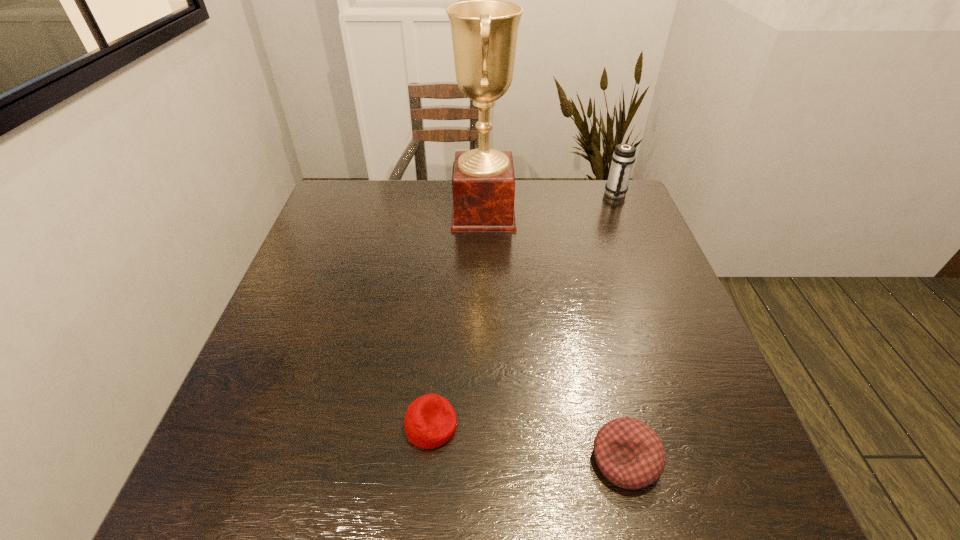
Where is `vacant region located on the side with the handle of the thermos bottle`? The height and width of the screenshot is (540, 960). vacant region located on the side with the handle of the thermos bottle is located at coordinates (655, 291).

Identify the location of vacant space located on the left of the third object from left to right. This screenshot has height=540, width=960. (478, 460).

The height and width of the screenshot is (540, 960). What are the coordinates of `blank space located on the seat area of the shorter beanbag` in the screenshot? It's located at [x=506, y=426].

The image size is (960, 540). Identify the location of trophy cup located in the far edge section of the desktop. point(484,29).

This screenshot has width=960, height=540. In order to click on thermos bottle located at the far edge in this screenshot , I will do `click(623, 157)`.

Where is `object situated at the near edge`? The width and height of the screenshot is (960, 540). object situated at the near edge is located at coordinates (629, 453).

You are a GUI agent. You are given a task and a screenshot of the screen. Output one action in this format:
    pyautogui.click(x=<x>, y=<y>)
    Task: Click on the object present at the right edge
    The width and height of the screenshot is (960, 540).
    Given the screenshot: What is the action you would take?
    pyautogui.click(x=623, y=157)

I want to click on object that is at the far right corner, so click(x=623, y=157).

In the image, there is a desktop. Where is `free space at the near edge`? The height and width of the screenshot is (540, 960). free space at the near edge is located at coordinates (295, 483).

I want to click on vacant area at the right edge, so click(x=629, y=240).